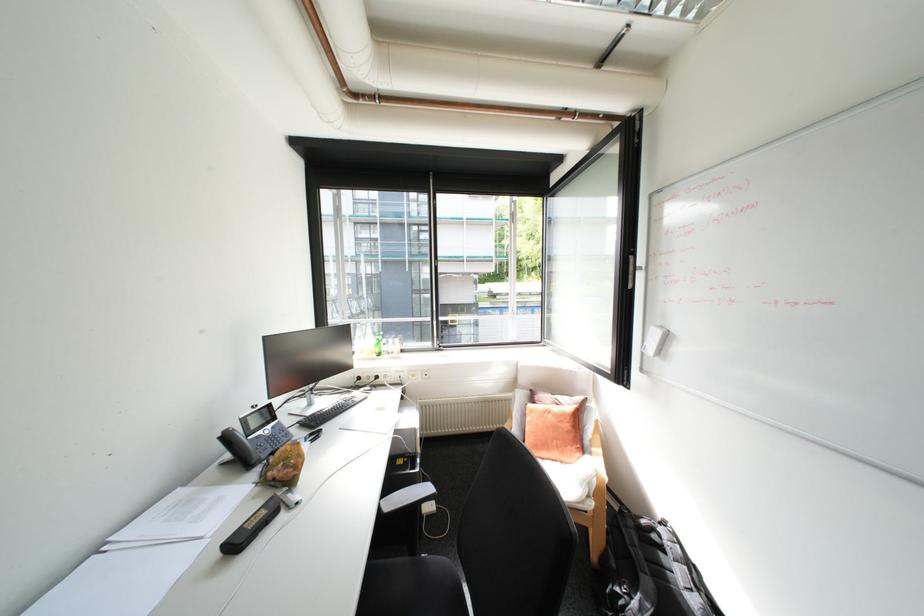
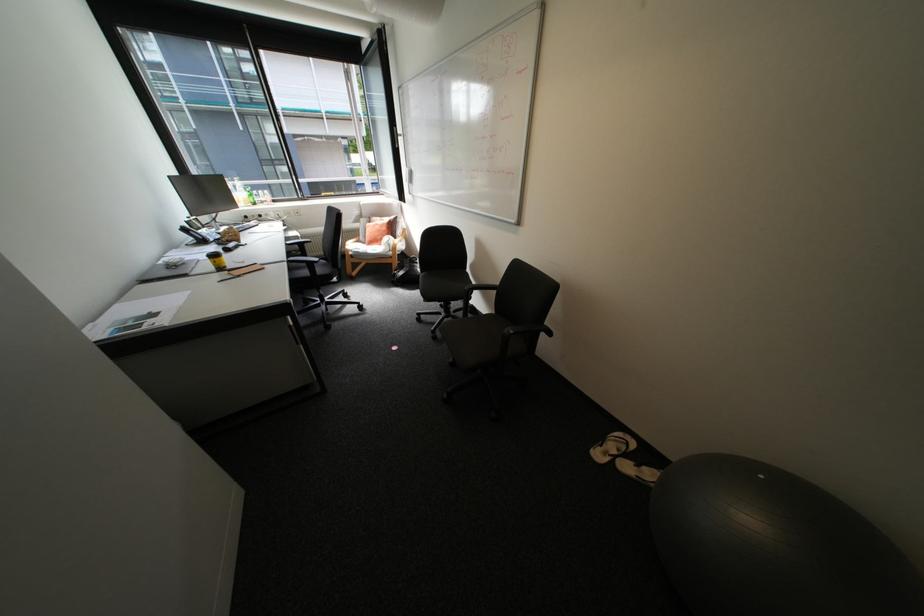
Locate, in the second image, the point that corresponds to (x=379, y=354) in the first image.

(256, 204)